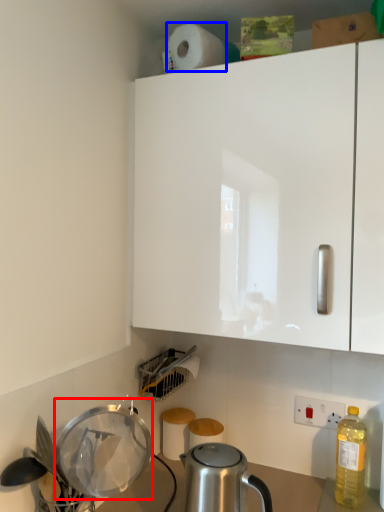
Question: Which object appears closest to the camera in this image, appliance (highlighted by a red box) or paper towel (highlighted by a blue box)?

Choices:
 (A) appliance
 (B) paper towel

Answer: (A)